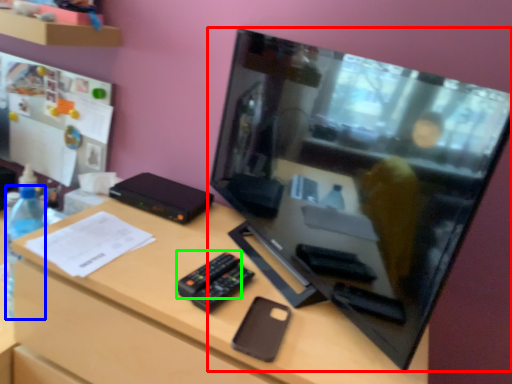
Question: Estimate the real-world distances between objects in this image. Which object is farther from television (highlighted by a red box), bottle (highlighted by a blue box) or remote (highlighted by a green box)?

Choices:
 (A) bottle
 (B) remote

Answer: (A)